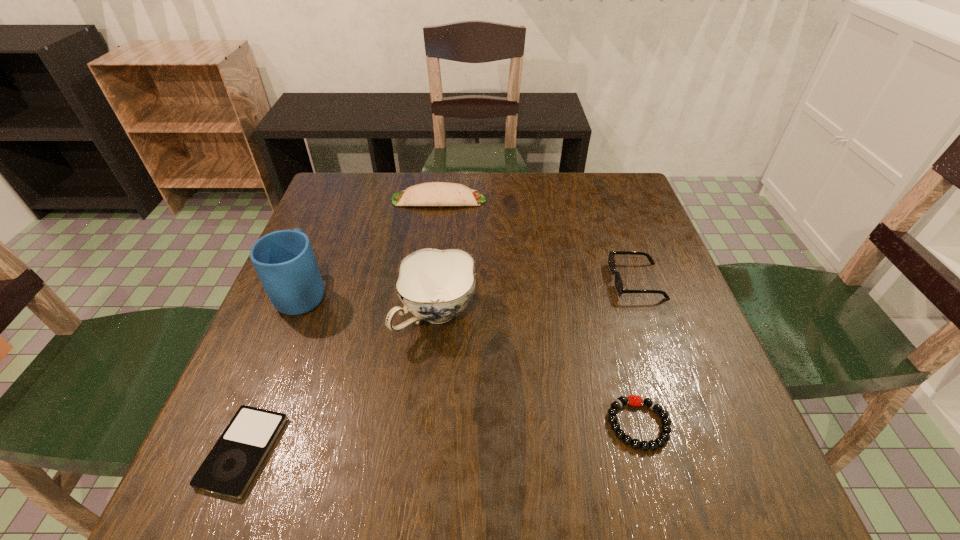
You are a GUI agent. You are given a task and a screenshot of the screen. Output one action in this format:
    pyautogui.click(x=<x>, y=<y>)
    Task: Click on the mug
    The image size is (960, 540).
    Given the screenshot: What is the action you would take?
    pyautogui.click(x=284, y=260)

This screenshot has height=540, width=960. What are the coordinates of `chinaware` in the screenshot? It's located at (435, 285).

You are a GUI agent. You are given a task and a screenshot of the screen. Output one action in this format:
    pyautogui.click(x=<x>, y=<y>)
    Task: Click on the sunglasses
    This screenshot has height=540, width=960.
    Given the screenshot: What is the action you would take?
    pyautogui.click(x=611, y=260)

Find the location of a particular element. burrito is located at coordinates (431, 193).

I want to click on the fifth tallest object, so click(664, 436).

Find the location of a particular element. the shortest object is located at coordinates (232, 463).

You are a GUI agent. You are given a task and a screenshot of the screen. Output one action in this format:
    pyautogui.click(x=<x>, y=<y>)
    Task: Click on the vacant space situated on the side of the mug with the handle
    
    Given the screenshot: What is the action you would take?
    pyautogui.click(x=346, y=187)

Where is `free location located 0.230m on the side of the mug with the handle`? free location located 0.230m on the side of the mug with the handle is located at coordinates (336, 211).

Find the location of `free region located on the side of the mug with the handle`. free region located on the side of the mug with the handle is located at coordinates (348, 182).

You are a GUI agent. You are given a task and a screenshot of the screen. Output one action in this format:
    pyautogui.click(x=<x>, y=<y>)
    Task: Click on the blank space located on the right of the fifth shortest object
    
    Given the screenshot: What is the action you would take?
    pyautogui.click(x=505, y=316)